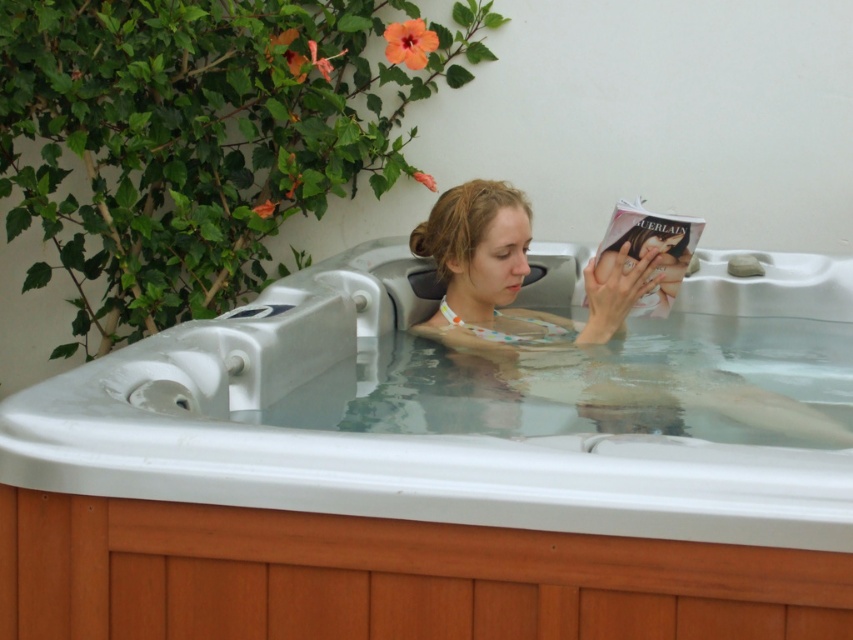
Question: Can you confirm if wooden hot tub at center is positioned above polka dot swimsuit at center?

Choices:
 (A) yes
 (B) no

Answer: (B)

Question: Does wooden hot tub at center lie behind polka dot swimsuit at center?

Choices:
 (A) yes
 (B) no

Answer: (B)

Question: Which point is farther to the camera?

Choices:
 (A) (3, 419)
 (B) (448, 212)

Answer: (B)

Question: From the image, what is the correct spatial relationship of wooden hot tub at center in relation to polka dot swimsuit at center?

Choices:
 (A) below
 (B) above

Answer: (A)